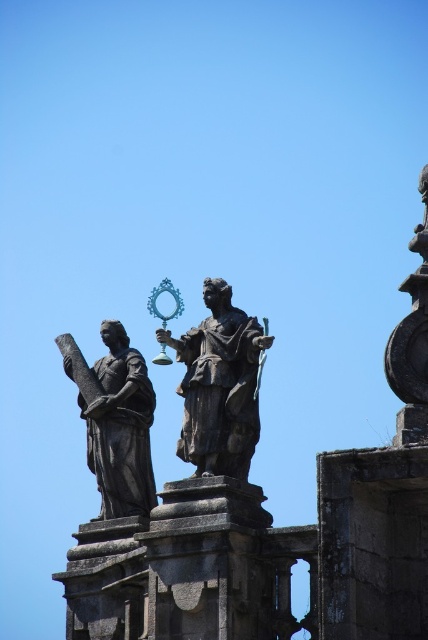
Question: In this image, where is polished bronze statue at center located relative to dark brown stone statue at upper center?

Choices:
 (A) below
 (B) above

Answer: (B)

Question: From the image, what is the correct spatial relationship of polished bronze statue at center in relation to dark brown stone statue at upper center?

Choices:
 (A) left
 (B) right

Answer: (B)

Question: From the image, what is the correct spatial relationship of polished bronze statue at center in relation to dark brown stone statue at upper center?

Choices:
 (A) left
 (B) right

Answer: (B)